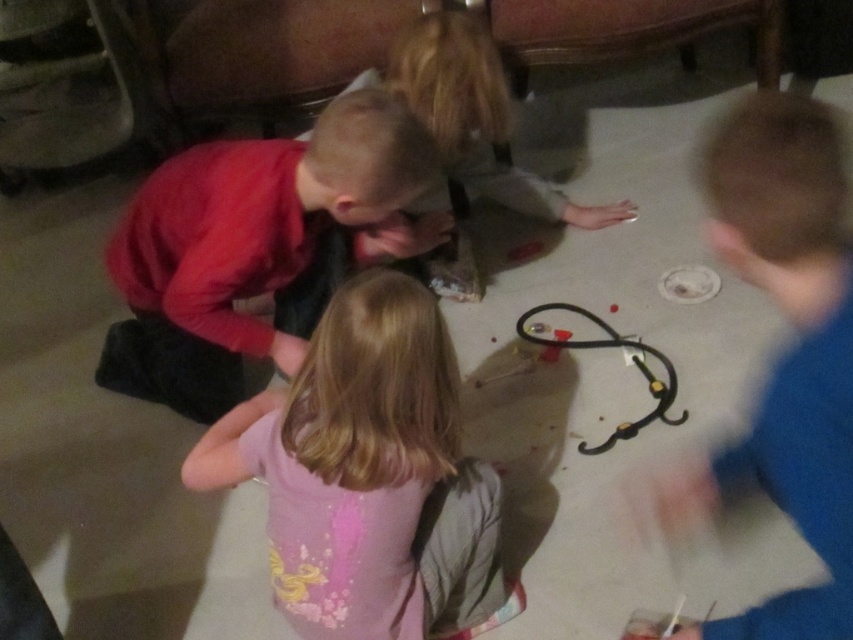
You are a photographer taking a picture of the two children in the living room. You notice the pink fabric shirt at center and the red matte shirt at center. Which child should you focus on to ensure the other stays in the background?

You should focus on the pink fabric shirt at center because it is closer to the viewer, which will keep the red matte shirt at center in the background.

You are a parent trying to locate your child who is playing with a black rubber train at center. Your child is wearing a pink fabric shirt at center. How far apart are the child and the train?

The pink fabric shirt at center is 58.77 centimeters away from the black rubber train at center, so the child wearing the pink fabric shirt at center is 58.77 centimeters away from the train.